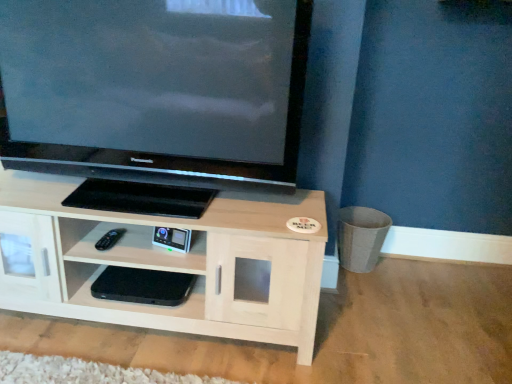
Where is `vacant space underneath matte black television at upper left (from a real-world perspective)`? vacant space underneath matte black television at upper left (from a real-world perspective) is located at coordinates (163, 203).